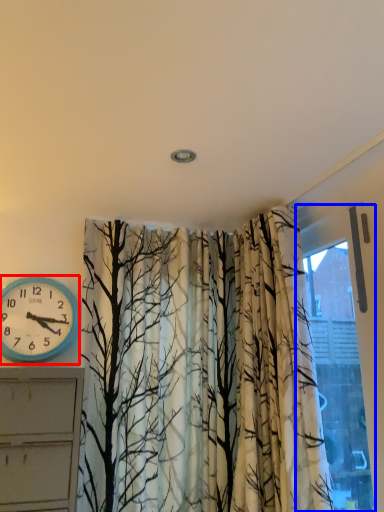
Question: Which object appears farthest to the camera in this image, wall clock (highlighted by a red box) or window (highlighted by a blue box)?

Choices:
 (A) wall clock
 (B) window

Answer: (A)